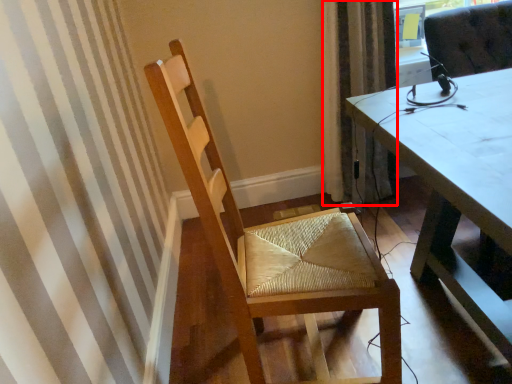
Question: From the image's perspective, where is curtain (annotated by the red box) located in relation to chair in the image?

Choices:
 (A) above
 (B) below

Answer: (A)